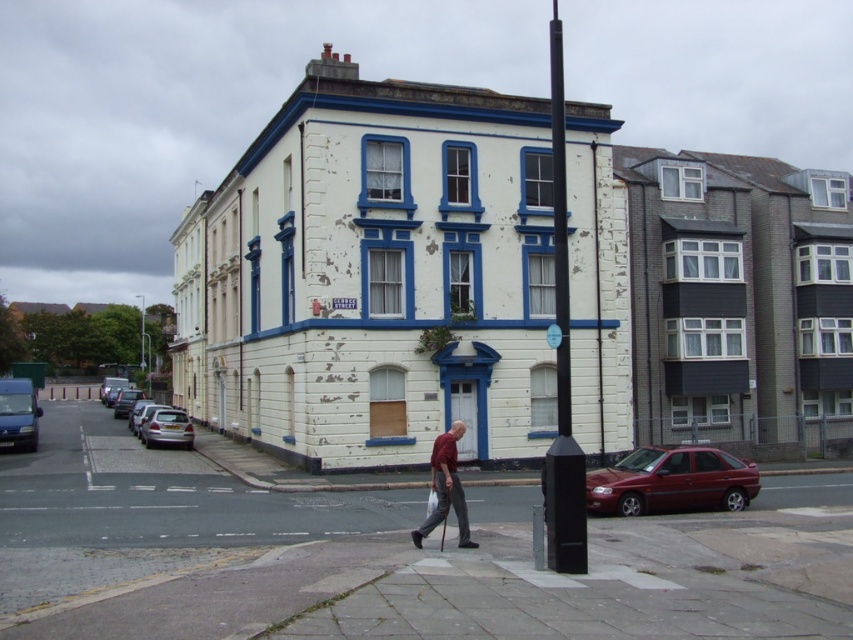
Question: Can you confirm if red fabric shirt at center is thinner than blue metallic van at left?

Choices:
 (A) yes
 (B) no

Answer: (A)

Question: Among these objects, which one is nearest to the camera?

Choices:
 (A) white plastic street sign at center
 (B) silver metallic hatchback at lower left
 (C) smooth concrete pavement at center
 (D) shiny maroon sedan at lower right

Answer: (C)

Question: Which of the following is the closest to the observer?

Choices:
 (A) (16, 404)
 (B) (553, 330)

Answer: (B)

Question: Is black plastic pole at center positioned before blue metallic van at left?

Choices:
 (A) no
 (B) yes

Answer: (B)

Question: Is black plastic pole at center to the left of white plastic street sign at center from the viewer's perspective?

Choices:
 (A) no
 (B) yes

Answer: (A)

Question: Among these objects, which one is farthest from the camera?

Choices:
 (A) blue metallic van at left
 (B) black plastic pole at center
 (C) white plastic street sign at center
 (D) smooth concrete pavement at center

Answer: (A)